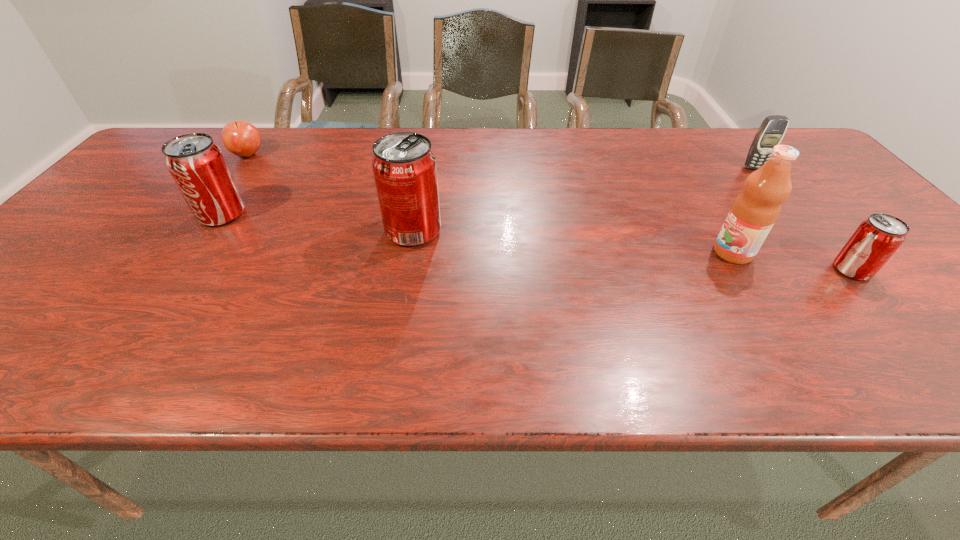
Where is `object positioned at the right edge`? object positioned at the right edge is located at coordinates (877, 238).

Identify the location of free space at the far edge of the desktop. The width and height of the screenshot is (960, 540). (364, 153).

I want to click on vacant space at the near edge, so click(857, 307).

At what (x,y) coordinates should I click in order to perform the action: click on free space at the left edge. Please return your answer as a coordinate pair (x, y). The image size is (960, 540). Looking at the image, I should click on (149, 176).

In the image, there is a desktop. Identify the location of free space at the right edge. (857, 208).

Identify the location of vacant point located between the second shortest object and the third object from left to right. pyautogui.click(x=633, y=251).

The height and width of the screenshot is (540, 960). What are the coordinates of `free spot between the rightmost pop soda and the cellular telephone` in the screenshot? It's located at (803, 219).

The width and height of the screenshot is (960, 540). I want to click on free space between the shortest object and the second pop soda from right to left, so click(x=331, y=193).

Locate an element on the screen. This screenshot has height=540, width=960. blank region between the third tallest object and the cellular telephone is located at coordinates (488, 191).

I want to click on empty space that is in between the apple and the fruit juice, so click(x=491, y=204).